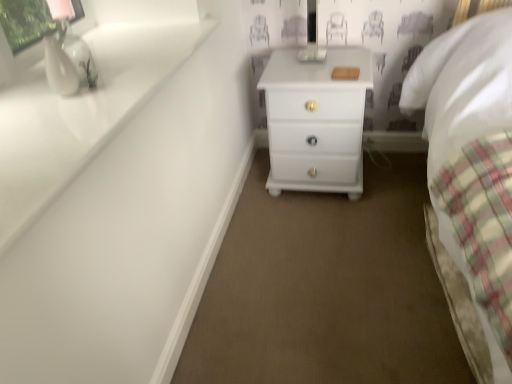
The height and width of the screenshot is (384, 512). What are the coordinates of `free spot above white glossy sink at upper left (from a real-world perspective)` in the screenshot? It's located at (91, 88).